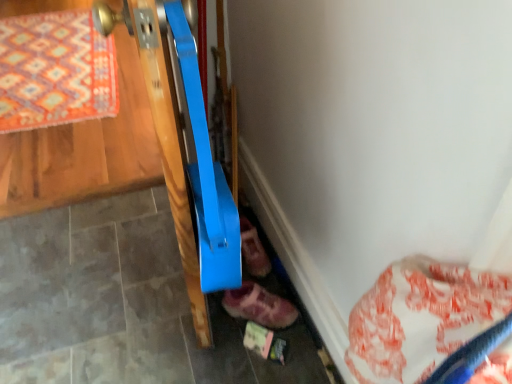
Question: Is orange patterned rug at upper left to the left or to the right of leather pink shoe at lower center, which is the first footwear in back-to-front order, in the image?

Choices:
 (A) left
 (B) right

Answer: (A)

Question: From the image's perspective, relative to leather pink shoe at lower center, acting as the 2th footwear starting from the front, is orange patterned rug at upper left above or below?

Choices:
 (A) below
 (B) above

Answer: (B)

Question: Which object is the closest to the orange patterned rug at upper left?

Choices:
 (A) leather pink shoe at lower center, which is the first footwear in back-to-front order
 (B) leather suede shoe at lower center, acting as the 2th footwear starting from the back

Answer: (A)

Question: Estimate the real-world distances between objects in this image. Which object is closer to the orange patterned rug at upper left?

Choices:
 (A) leather pink shoe at lower center, which is the first footwear in back-to-front order
 (B) leather suede shoe at lower center, acting as the 2th footwear starting from the back

Answer: (A)